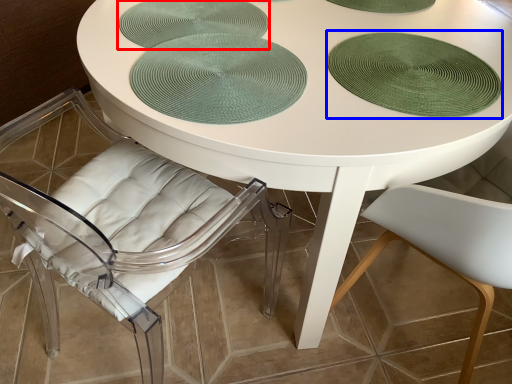
Question: Which of the following is the farthest to the observer, glass plate (highlighted by a red box) or glass plate (highlighted by a blue box)?

Choices:
 (A) glass plate
 (B) glass plate

Answer: (A)